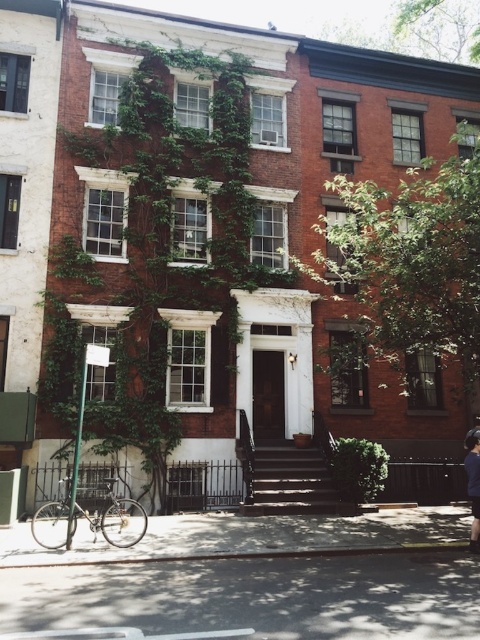
Question: Does green ivy at center appear on the right side of dark brown wooden stairs at center?

Choices:
 (A) no
 (B) yes

Answer: (A)

Question: Based on their relative distances, which object is farther from the dark blue fabric jacket at center?

Choices:
 (A) dark brown wooden stairs at center
 (B) green ivy at center

Answer: (B)

Question: In this image, where is green ivy at center located relative to dark blue fabric jacket at center?

Choices:
 (A) left
 (B) right

Answer: (A)

Question: Can you confirm if green ivy at center is positioned to the right of dark blue fabric jacket at center?

Choices:
 (A) no
 (B) yes

Answer: (A)

Question: Which point is farther to the camera?

Choices:
 (A) (466, 467)
 (B) (275, 444)

Answer: (B)

Question: Which is farther from the dark brown wooden stairs at center?

Choices:
 (A) dark blue fabric jacket at center
 (B) green ivy at center

Answer: (B)